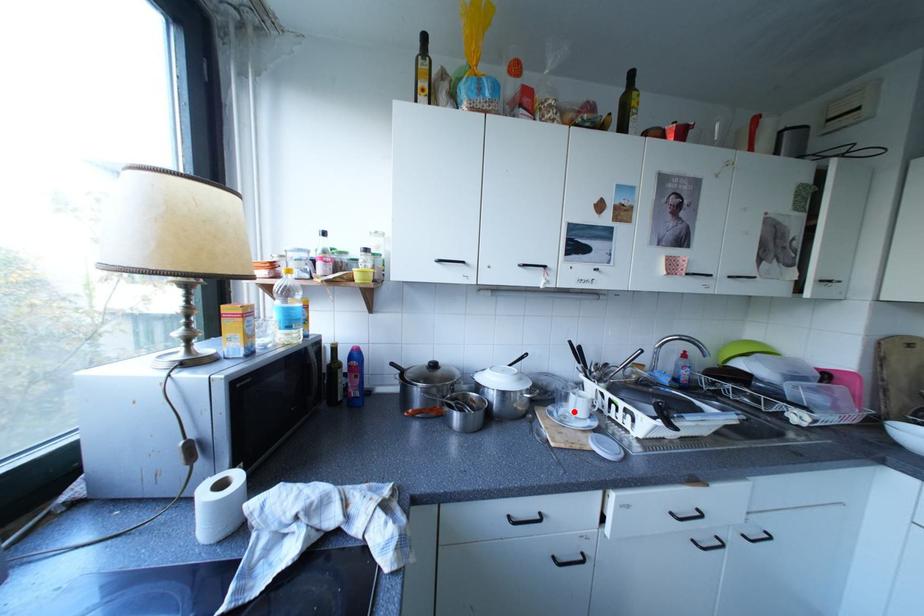
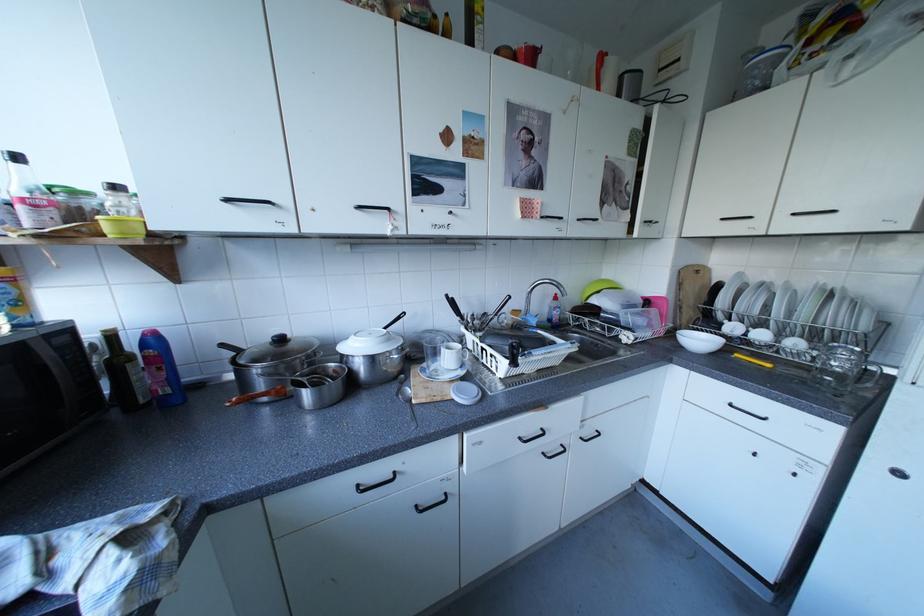
The point at the highlighted location is marked in the first image. Where is the corresponding point in the second image?

(445, 367)